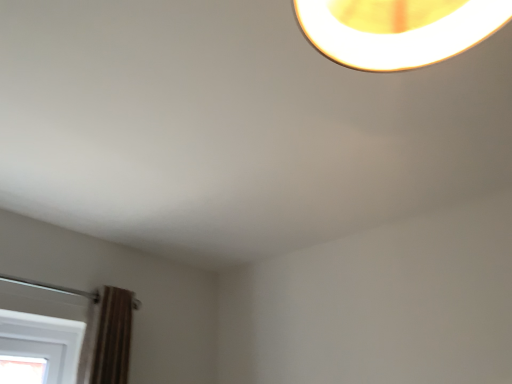
Question: Should I look upward or downward to see white glossy lampshade at upper center?

Choices:
 (A) down
 (B) up

Answer: (B)